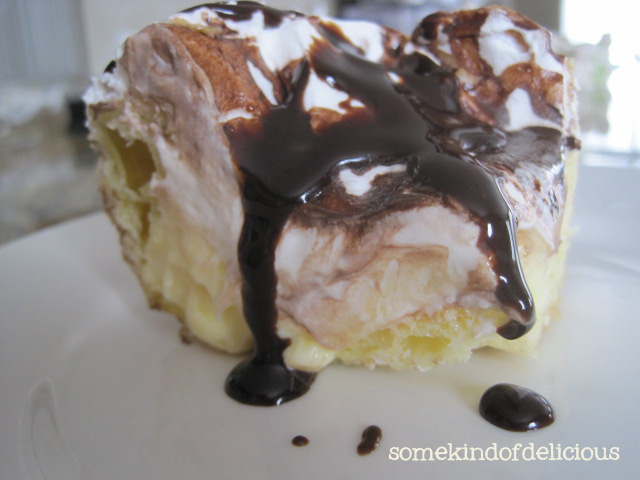
Where is `white plate`? white plate is located at coordinates (608, 310).